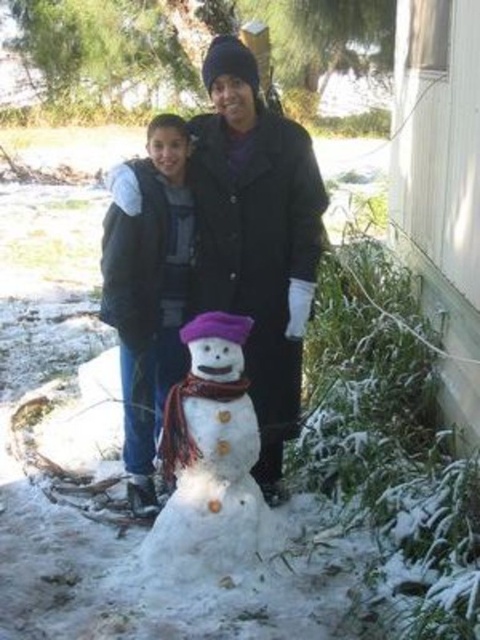
You are a photographer trying to capture a photo of both the matte black coat at center and the white fluffy snowman at center in the same frame. Given that your camera has a maximum focus range of 20 inches, will you be able to include both subjects in focus?

The matte black coat at center and the white fluffy snowman at center are 19.97 inches apart, which is within the camera maximum focus range of 20 inches. Therefore, you can include both subjects in focus.

You are planning to build a snowman and have two snowmen in the image as examples. Which snowman at center would require more snow to build, the white matte snowman at center or the white fluffy snowman at center?

The white matte snowman at center requires more snow because it is bigger than the white fluffy snowman at center.

Based on the photo, you are trying to decide whether to place a new decorative snow globe on the ground between the white matte snowman at center and the matte black coat at center. Based on their sizes, which object should you place the snow globe closer to to ensure it doesn

The white matte snowman at center is wider than the matte black coat at center. Therefore, placing the snow globe closer to the white matte snowman at center would provide more space between them compared to positioning it near the matte black coat at center.